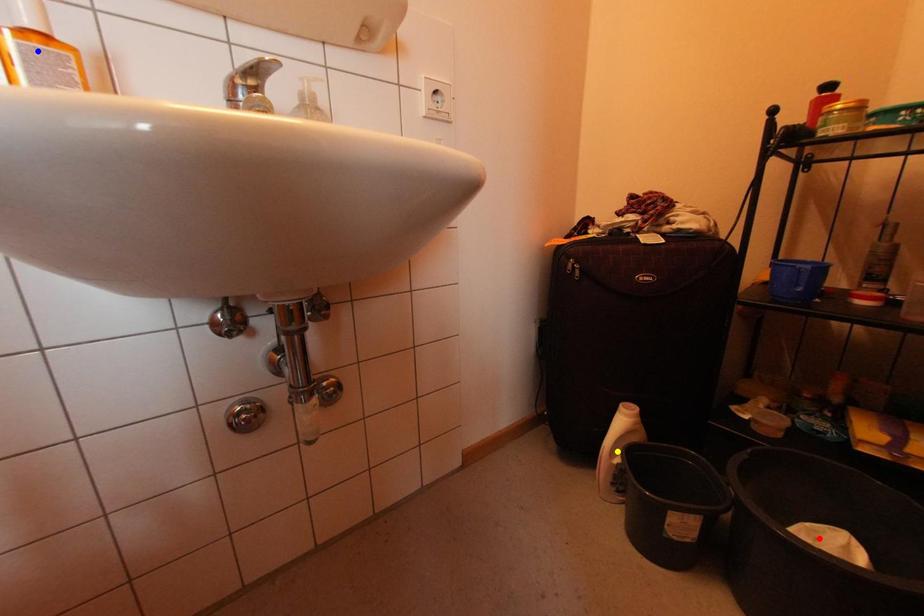
Consider the image. Order these from nearest to farthest:
yellow point, red point, blue point

1. blue point
2. red point
3. yellow point